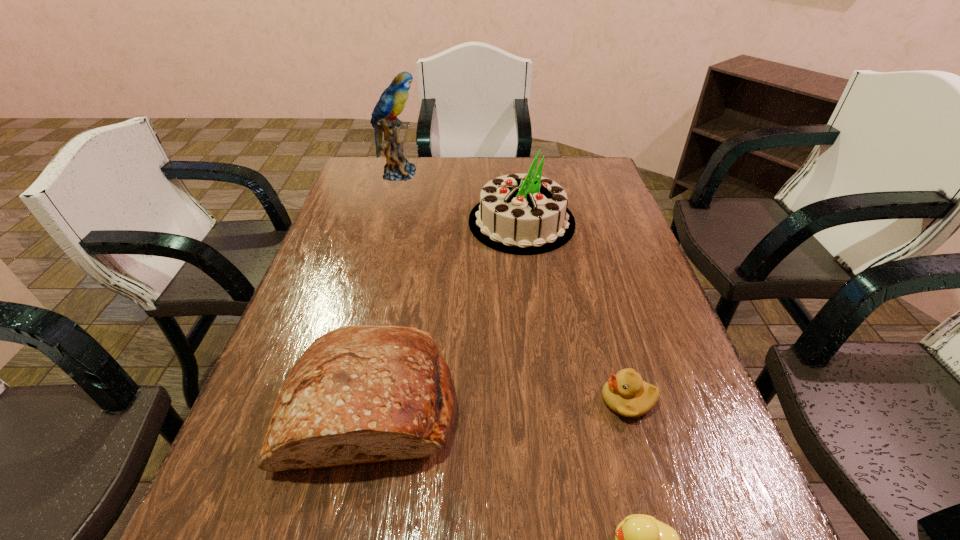
You are a GUI agent. You are given a task and a screenshot of the screen. Output one action in this format:
    pyautogui.click(x=<x>, y=<y>)
    Task: Click on the vacant point at the far left corner
    This screenshot has width=960, height=540.
    Given the screenshot: What is the action you would take?
    pyautogui.click(x=352, y=191)

The image size is (960, 540). What are the coordinates of `vacant area at the far right corner of the desktop` in the screenshot? It's located at (599, 160).

At what (x,y) coordinates should I click in order to perform the action: click on blank area at the near right corner. Please return your answer as a coordinate pair (x, y). Looking at the image, I should click on (686, 533).

This screenshot has height=540, width=960. Find the location of `free spot between the second farthest object and the farthest object`. free spot between the second farthest object and the farthest object is located at coordinates (460, 198).

At what (x,y) coordinates should I click in order to perform the action: click on free point between the bread and the farthest object. Please return your answer as a coordinate pair (x, y). This screenshot has width=960, height=540. Looking at the image, I should click on (385, 288).

Identify the location of free space between the third shortest object and the parrot. (385, 288).

Identify the location of free space that is in between the bread and the farther duckling. (499, 402).

Locate an element on the screen. The width and height of the screenshot is (960, 540). empty space between the tallest object and the birthday cake is located at coordinates (460, 198).

Locate an element on the screen. Image resolution: width=960 pixels, height=540 pixels. vacant point located between the fourth shortest object and the farther duckling is located at coordinates (574, 311).

Identify which object is the nearest to the fourth nearest object. Please provide its 2D coordinates. Your answer should be formatted as a tuple, i.e. [(x, y)], where the tuple contains the x and y coordinates of a point satisfying the conditions above.

[(392, 101)]